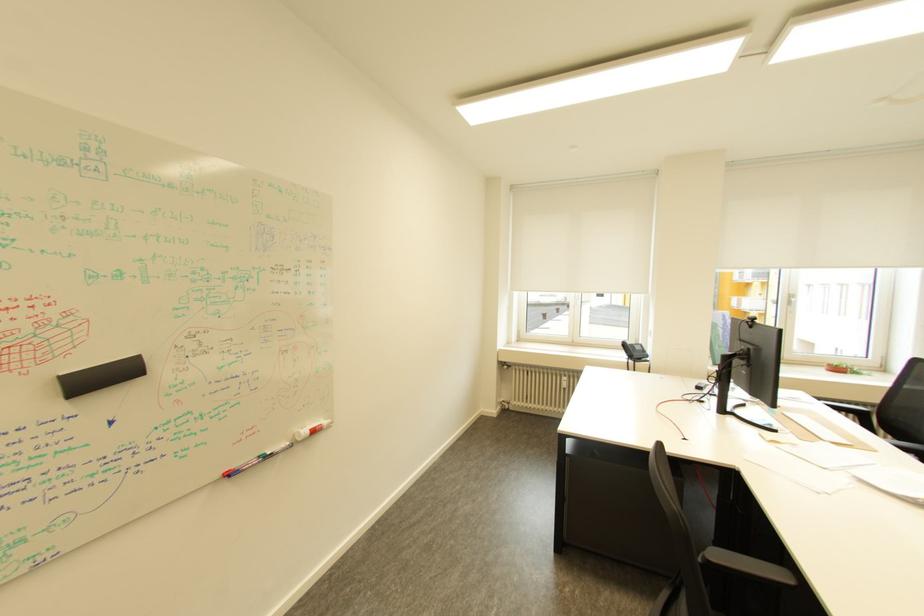
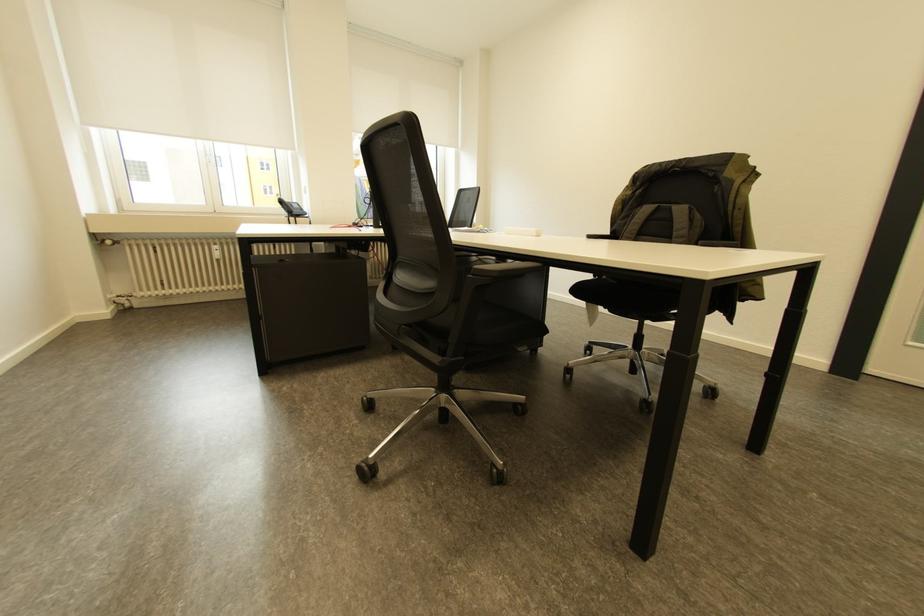
Question: The camera is either moving clockwise (left) or counter-clockwise (right) around the object. The first image is from the beginning of the video and the second image is from the end. Is the camera moving left or right when shooting the video?

Choices:
 (A) Left
 (B) Right

Answer: (A)